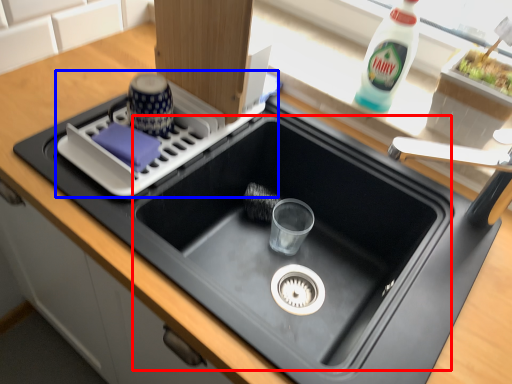
Question: Which object appears farthest to the camera in this image, sink (highlighted by a red box) or appliance (highlighted by a blue box)?

Choices:
 (A) sink
 (B) appliance

Answer: (B)